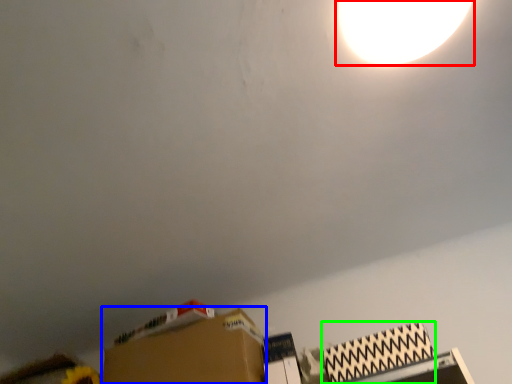
Question: Which object is the closest to the lamp (highlighted by a red box)? Choose among these: cardboard box (highlighted by a blue box) or cardboard box (highlighted by a green box).

Choices:
 (A) cardboard box
 (B) cardboard box

Answer: (B)